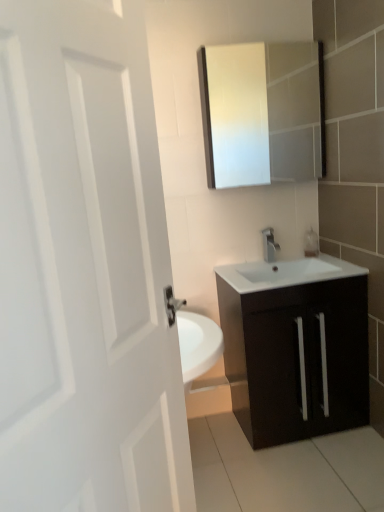
I want to click on free spot to the left of silver metallic tap at center, so click(244, 267).